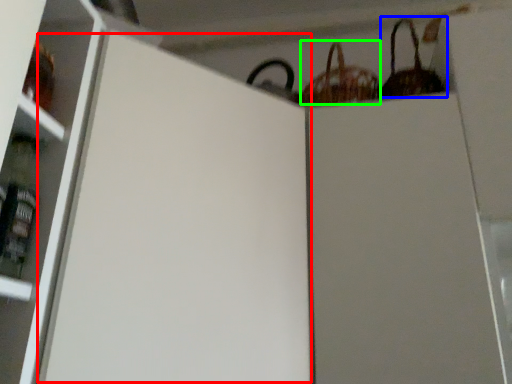
Question: Which object is positioned closest to screen door (highlighted by a red box)? Select from basket (highlighted by a blue box) and basket (highlighted by a green box).

Choices:
 (A) basket
 (B) basket

Answer: (B)